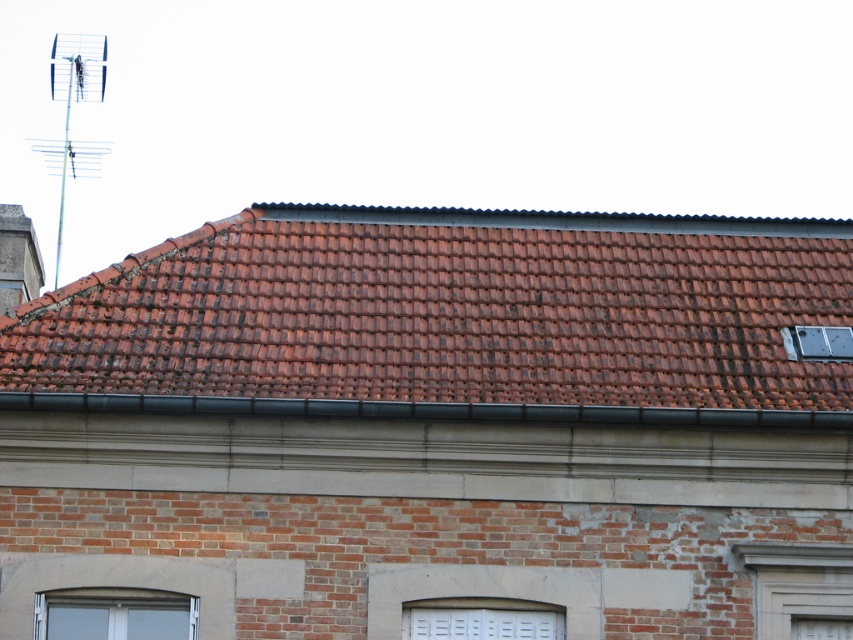
In the scene shown: Is brown clay tiles at upper center smaller than matte glass window at lower left?

Incorrect, brown clay tiles at upper center is not smaller in size than matte glass window at lower left.

Identify the location of brown clay tiles at upper center. (453, 314).

The width and height of the screenshot is (853, 640). What are the coordinates of `brown clay tiles at upper center` in the screenshot? It's located at (453, 314).

Between brown clay tiles at upper center and white painted wood window at lower center, which one is positioned higher?

brown clay tiles at upper center is above.

What are the coordinates of `brown clay tiles at upper center` in the screenshot? It's located at (453, 314).

I want to click on brown clay tiles at upper center, so click(453, 314).

Who is taller, matte glass window at lower left or white painted wood window at lower center?

matte glass window at lower left

Between matte glass window at lower left and white painted wood window at lower center, which one appears on the left side from the viewer's perspective?

From the viewer's perspective, matte glass window at lower left appears more on the left side.

Is point (73, 614) farther from camera compared to point (480, 600)?

Yes, it is.

Where is `matte glass window at lower left`? The image size is (853, 640). matte glass window at lower left is located at coordinates 115,614.